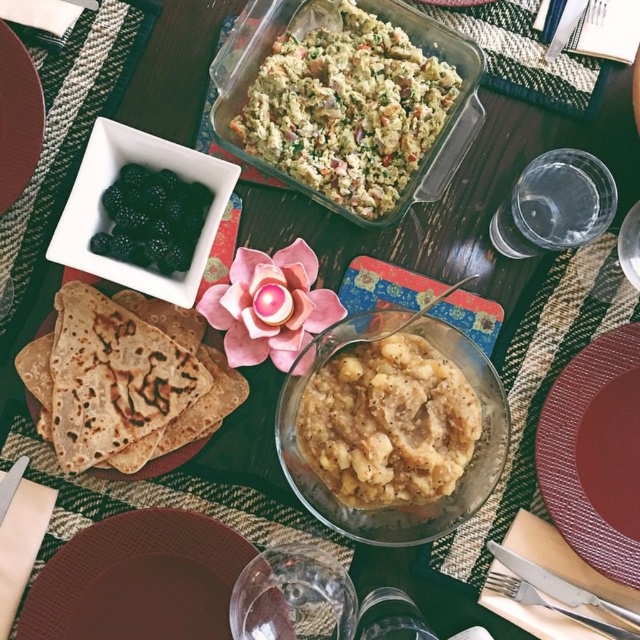
Question: Does brown/crumbly flatbread at lower left appear over dark glossy jam at upper left?

Choices:
 (A) no
 (B) yes

Answer: (A)

Question: Which object is the closest to the green crumbly mixture at center?

Choices:
 (A) brown matte platter at upper left
 (B) silver plated fork at lower right
 (C) smooth brown mashed potatoes at center
 (D) brown matte plate at lower left

Answer: (C)

Question: Is green crumbly mixture at center smaller than dark glossy jam at upper left?

Choices:
 (A) no
 (B) yes

Answer: (A)

Question: Is smooth brown mashed potatoes at center further to the viewer compared to silver plated fork at lower right?

Choices:
 (A) no
 (B) yes

Answer: (A)

Question: Which object is positioned closest to the silver plated fork at lower right?

Choices:
 (A) green crumbly mixture at center
 (B) brown matte plate at lower left

Answer: (A)

Question: Which object appears farthest from the camera in this image?

Choices:
 (A) green crumbly mixture at center
 (B) silver plated fork at lower right

Answer: (B)